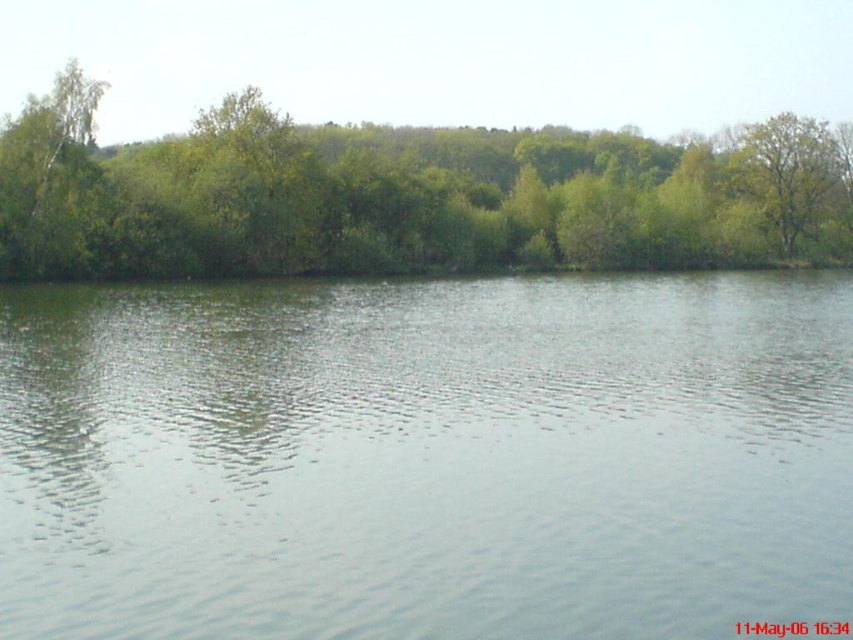
Question: Does green leafy tree at upper center have a greater width compared to green leafy tree at upper right?

Choices:
 (A) yes
 (B) no

Answer: (A)

Question: Which point appears farthest from the camera in this image?

Choices:
 (A) (757, 177)
 (B) (432, 291)

Answer: (A)

Question: Based on their relative distances, which object is farther from the green leafy tree at upper right?

Choices:
 (A) clear water at center
 (B) green leafy tree at upper center

Answer: (A)

Question: Is clear water at center wider than green leafy tree at upper right?

Choices:
 (A) yes
 (B) no

Answer: (A)

Question: Which point is closer to the camera?

Choices:
 (A) clear water at center
 (B) green leafy tree at upper right

Answer: (A)

Question: Is clear water at center smaller than green leafy tree at upper right?

Choices:
 (A) yes
 (B) no

Answer: (A)